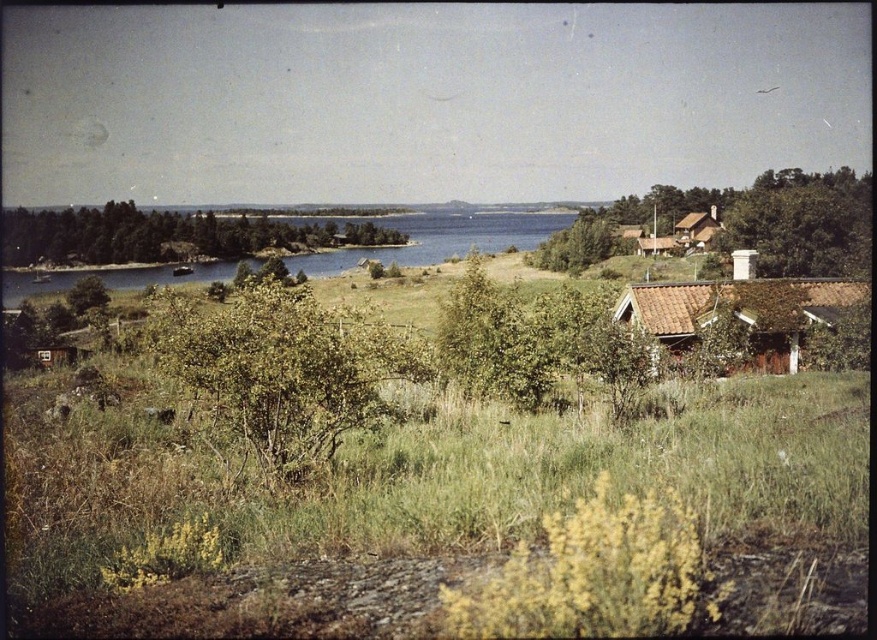
Does green leafy bush at center have a lesser height compared to blue water at center?

Indeed, green leafy bush at center has a lesser height compared to blue water at center.

Can you confirm if green leafy bush at center is positioned above blue water at center?

Actually, green leafy bush at center is below blue water at center.

Find the location of a particular element. This screenshot has width=877, height=640. green leafy bush at center is located at coordinates (280, 372).

Is green leafy tree at center thinner than green leafy tree at center-right?

No.

Based on the photo, can you confirm if green leafy tree at center is taller than green leafy tree at center-right?

Yes, green leafy tree at center is taller than green leafy tree at center-right.

Is point (102, 234) positioned in front of point (540, 259)?

No, (102, 234) is behind (540, 259).

What are the coordinates of `green leafy tree at center` in the screenshot? It's located at (168, 236).

Is green leafy bush at center further to the viewer compared to green leafy tree at upper right?

No.

Who is positioned more to the right, green leafy bush at center or green leafy tree at upper right?

green leafy tree at upper right is more to the right.

Find the location of a particular element. green leafy bush at center is located at coordinates (280, 372).